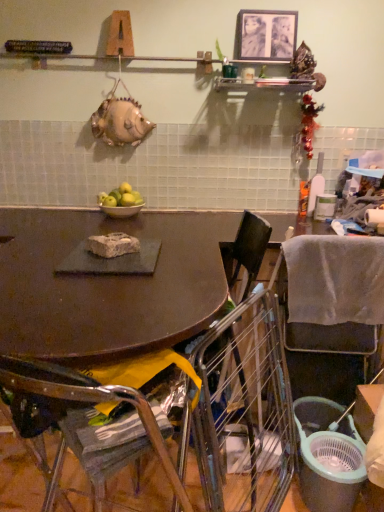
At what (x,y) coordinates should I click in order to perform the action: click on free space above metallic silver chair at lower left, the 1th chair viewed from the left (from a real-world perspective). Please return your answer as a coordinate pair (x, y). The width and height of the screenshot is (384, 512). Looking at the image, I should click on (116, 407).